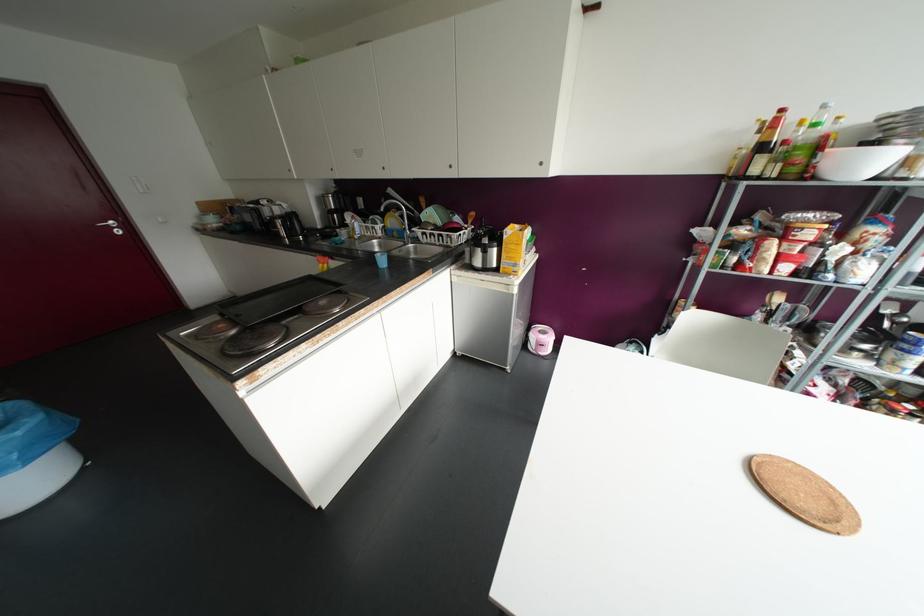
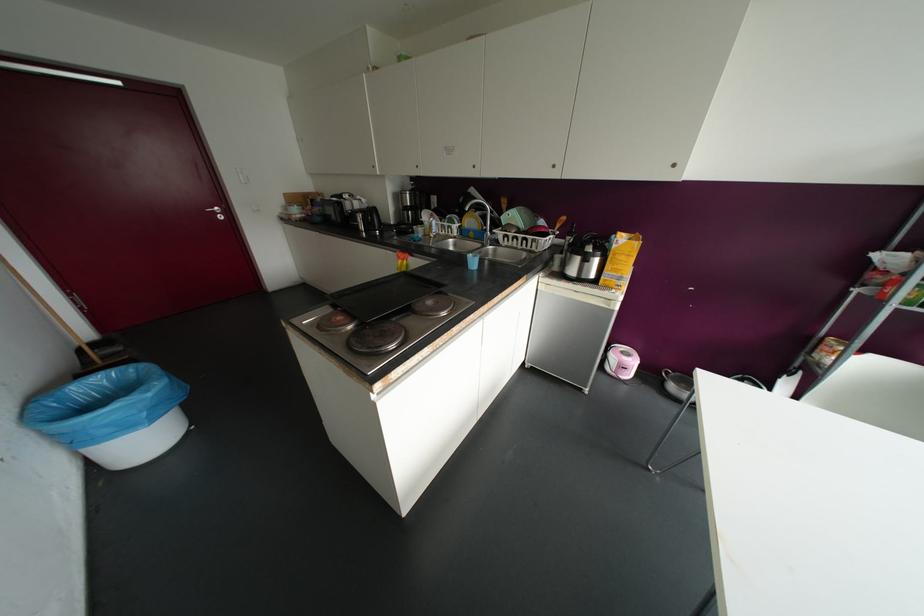
Locate, in the second image, the point that corresponds to pixel 383 168 in the first image.

(473, 166)